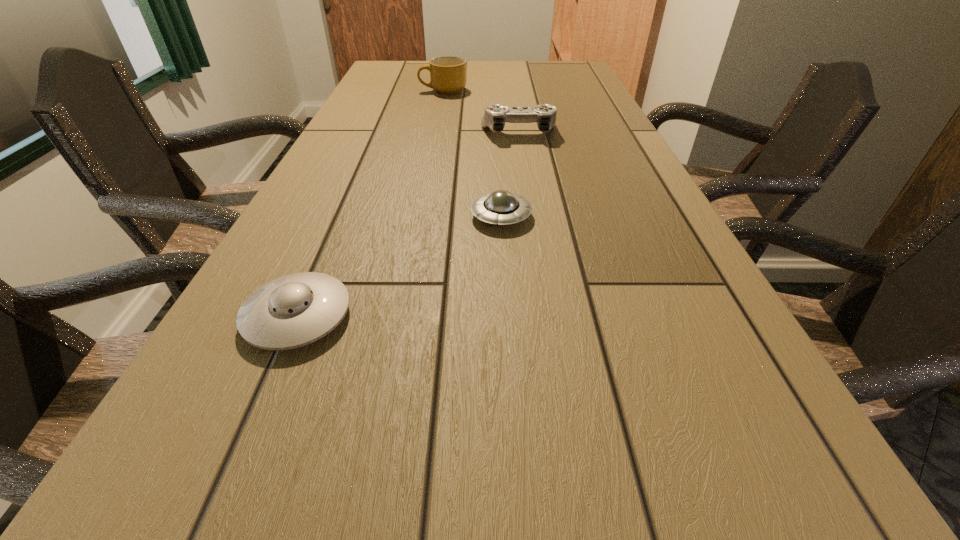
You are a GUI agent. You are given a task and a screenshot of the screen. Output one action in this format:
    pyautogui.click(x=<x>, y=<y>)
    Task: Click on the blank space located 0.190m on the front of the second tallest object
    The width and height of the screenshot is (960, 540).
    Given the screenshot: What is the action you would take?
    pyautogui.click(x=526, y=179)

The height and width of the screenshot is (540, 960). In order to click on vacant space located on the back of the second nearest object in this screenshot , I will do `click(495, 132)`.

Find the location of a particular element. This screenshot has width=960, height=540. free space located on the front of the nearest object is located at coordinates (258, 408).

The image size is (960, 540). Identify the location of object positioned at the left edge. (292, 311).

Identify the location of free region at the far edge of the desktop. This screenshot has width=960, height=540. (506, 73).

Locate an element on the screen. Image resolution: width=960 pixels, height=540 pixels. vacant region at the left edge is located at coordinates (373, 103).

This screenshot has width=960, height=540. In the image, there is a desktop. In order to click on free space at the right edge in this screenshot , I will do `click(678, 321)`.

This screenshot has width=960, height=540. Find the location of `vacant space at the far left corner`. vacant space at the far left corner is located at coordinates (420, 63).

I want to click on vacant region at the far right corner of the desktop, so click(x=584, y=79).

You are a GUI agent. You are given a task and a screenshot of the screen. Output one action in this format:
    pyautogui.click(x=<x>, y=<y>)
    Task: Click on the vacant space in between the third nearest object and the right saucer
    The image size is (960, 540).
    Given the screenshot: What is the action you would take?
    pyautogui.click(x=510, y=174)